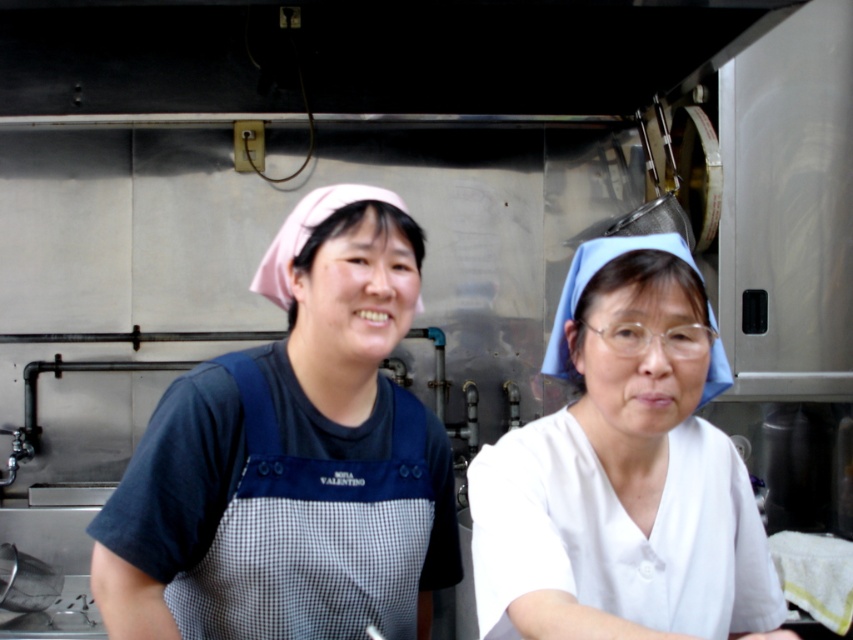
You are a chef in a busy kitchen and need to place a new ingredient on the counter. You have a white fabric at center and a black checkered apron at center in your view. Which object should you place the ingredient on to ensure it stays above the other?

The white fabric at center is located above the black checkered apron at center, so placing the ingredient on the white fabric at center will keep it above the black checkered apron at center.

You are a chef in a busy kitchen and need to cover a dish with a cloth. You have the white fabric at center and the black checkered apron at center. Which one is more suitable for covering the dish based on their sizes?

The white fabric at center is more suitable because it has a smaller size compared to the black checkered apron at center, making it easier to fit over the dish without excess material.

You are standing in the kitchen and need to place a new label on the white fabric at center. According to the coordinates provided, where exactly should you position the label?

The white fabric at center should be labeled at the coordinates point (624,472) as specified.